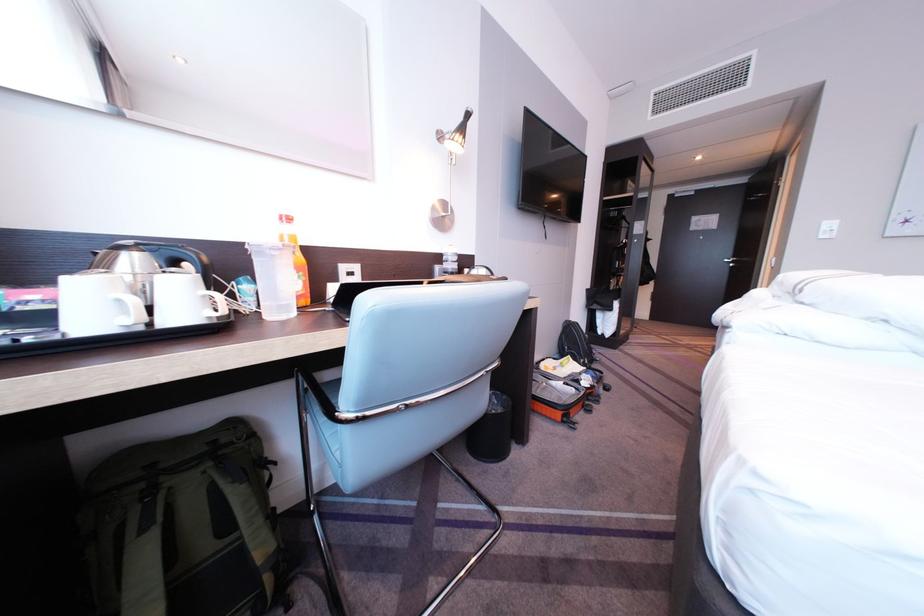
Identify the location of green backpack. (183, 525).